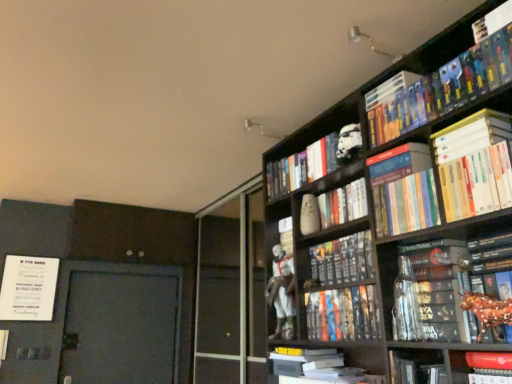
Question: Can you confirm if white matte book at upper right, which is the third book from top to bottom, is smaller than hardcover books at upper right, which is the 2th book in top-to-bottom order?

Choices:
 (A) no
 (B) yes

Answer: (B)

Question: Considering the relative positions of white matte book at upper right, the 10th book in the bottom-to-top sequence, and hardcover books at upper right, which is the 11th book in bottom-to-top order, in the image provided, is white matte book at upper right, the 10th book in the bottom-to-top sequence, to the right of hardcover books at upper right, which is the 11th book in bottom-to-top order, from the viewer's perspective?

Choices:
 (A) yes
 (B) no

Answer: (A)

Question: Can you confirm if white matte book at upper right, which is the third book from top to bottom, is positioned to the left of hardcover books at upper right, which is the 2th book in top-to-bottom order?

Choices:
 (A) yes
 (B) no

Answer: (B)

Question: Is white matte book at upper right, the 10th book in the bottom-to-top sequence, outside hardcover books at upper right, which is the 11th book in bottom-to-top order?

Choices:
 (A) no
 (B) yes

Answer: (B)

Question: Is white matte book at upper right, the 10th book in the bottom-to-top sequence, shorter than hardcover books at upper right, which is the 11th book in bottom-to-top order?

Choices:
 (A) no
 (B) yes

Answer: (B)

Question: Is rubberized red toy at lower right, which appears as the 9th book when viewed from the top, bigger or smaller than shiny metallic horse at right, placed as the fifth book when sorted from bottom to top?

Choices:
 (A) big
 (B) small

Answer: (B)

Question: In the image, is rubberized red toy at lower right, which is counted as the 4th book, starting from the bottom, on the left side or the right side of shiny metallic horse at right, which ranks as the 8th book in top-to-bottom order?

Choices:
 (A) left
 (B) right

Answer: (B)

Question: From their relative heights in the image, would you say rubberized red toy at lower right, which is counted as the 4th book, starting from the bottom, is taller or shorter than shiny metallic horse at right, which ranks as the 8th book in top-to-bottom order?

Choices:
 (A) tall
 (B) short

Answer: (B)

Question: Considering their positions, is rubberized red toy at lower right, which is counted as the 4th book, starting from the bottom, located in front of or behind shiny metallic horse at right, which ranks as the 8th book in top-to-bottom order?

Choices:
 (A) behind
 (B) front

Answer: (A)

Question: In terms of width, does white glossy statue at center look wider or thinner when compared to hardcover books at upper right, which is the 2th book in top-to-bottom order?

Choices:
 (A) thin
 (B) wide

Answer: (A)

Question: Is white glossy statue at center bigger or smaller than hardcover books at upper right, which is the 2th book in top-to-bottom order?

Choices:
 (A) small
 (B) big

Answer: (B)

Question: Is point (228, 301) positioned closer to the camera than point (489, 44)?

Choices:
 (A) farther
 (B) closer

Answer: (A)

Question: From a real-world perspective, relative to hardcover books at upper right, which is the 11th book in bottom-to-top order, is white glossy statue at center vertically above or below?

Choices:
 (A) below
 (B) above

Answer: (A)

Question: From the image's perspective, relative to hardcover book at upper right, which appears as the 12th book when ordered from the bottom, is hardcover books at upper right, which is the 2th book in top-to-bottom order, above or below?

Choices:
 (A) below
 (B) above

Answer: (A)

Question: Is hardcover books at upper right, which is the 11th book in bottom-to-top order, taller or shorter than hardcover book at upper right, which appears as the 1th book when viewed from the top?

Choices:
 (A) tall
 (B) short

Answer: (A)